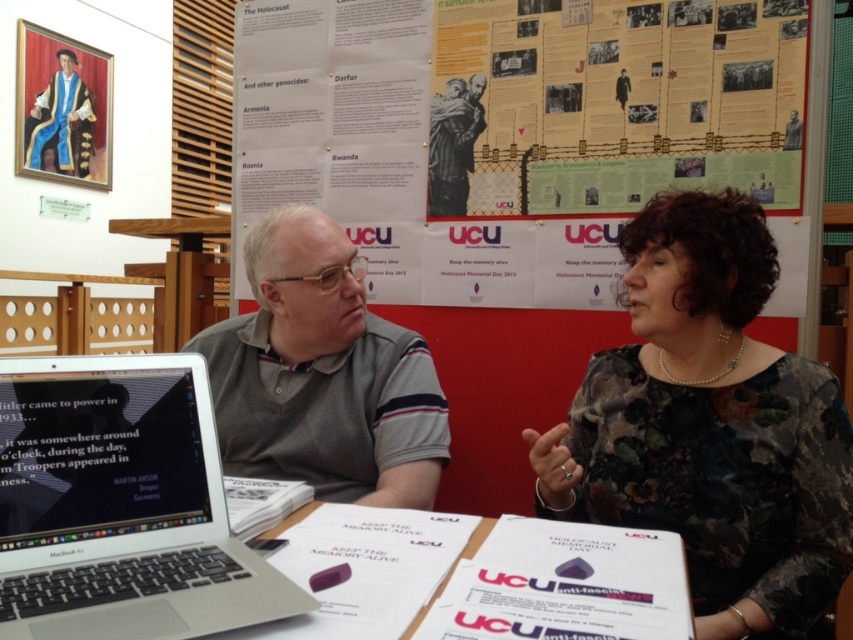
From the picture: Who is more forward, (331, 49) or (91, 400)?

Point (91, 400)

Who is taller, yellow paper poster at upper center or silver metallic laptop at left?

yellow paper poster at upper center is taller.

Between point (393, 88) and point (172, 420), which one is positioned in front?

Point (172, 420) is more forward.

Identify the location of yellow paper poster at upper center. Image resolution: width=853 pixels, height=640 pixels. (517, 131).

What do you see at coordinates (517, 131) in the screenshot? I see `yellow paper poster at upper center` at bounding box center [517, 131].

Is point (265, 106) farther from viewer compared to point (306, 285)?

Yes.

Is point (386, 90) farther from viewer compared to point (244, 316)?

Yes.

The image size is (853, 640). Find the location of `yellow paper poster at upper center`. yellow paper poster at upper center is located at coordinates (517, 131).

Who is more distant from viewer, (x=334, y=243) or (x=397, y=586)?

Point (x=334, y=243)

Does point (274, 445) come behind point (335, 520)?

Yes, it is.

Between point (323, 369) and point (364, 624), which one is positioned behind?

The point (323, 369) is behind.

This screenshot has width=853, height=640. Find the location of `gray cotton shirt at center`. gray cotton shirt at center is located at coordinates (322, 374).